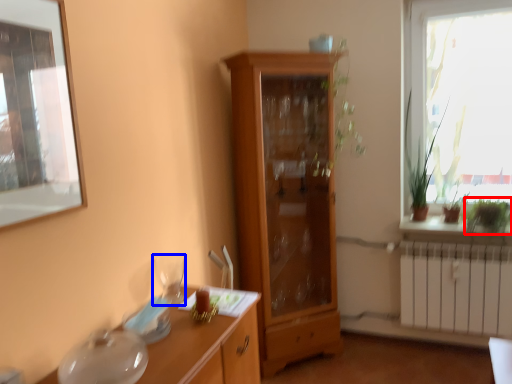
Question: Which point is further to the camera, plant (highlighted by a red box) or tableware (highlighted by a blue box)?

Choices:
 (A) plant
 (B) tableware

Answer: (A)